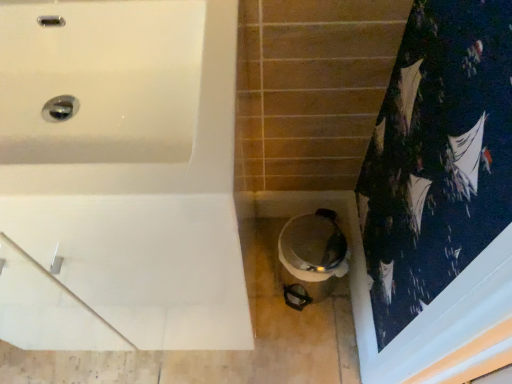
Question: Is white glossy bathtub at upper left to the right of white glossy toilet at lower center from the viewer's perspective?

Choices:
 (A) yes
 (B) no

Answer: (B)

Question: From the image's perspective, is white glossy bathtub at upper left below white glossy toilet at lower center?

Choices:
 (A) no
 (B) yes

Answer: (A)

Question: From the image's perspective, would you say white glossy bathtub at upper left is positioned over white glossy toilet at lower center?

Choices:
 (A) yes
 (B) no

Answer: (A)

Question: Is white glossy bathtub at upper left not near white glossy toilet at lower center?

Choices:
 (A) yes
 (B) no

Answer: (B)

Question: Does white glossy bathtub at upper left have a smaller size compared to white glossy toilet at lower center?

Choices:
 (A) no
 (B) yes

Answer: (A)

Question: From a real-world perspective, is white glossy bathtub at upper left physically above white glossy toilet at lower center?

Choices:
 (A) yes
 (B) no

Answer: (A)

Question: From the image's perspective, would you say white glossy toilet at lower center is positioned over white glossy bathtub at upper left?

Choices:
 (A) no
 (B) yes

Answer: (A)

Question: Does white glossy toilet at lower center come in front of white glossy bathtub at upper left?

Choices:
 (A) no
 (B) yes

Answer: (A)

Question: Can you confirm if white glossy toilet at lower center is smaller than white glossy bathtub at upper left?

Choices:
 (A) yes
 (B) no

Answer: (A)

Question: Is white glossy toilet at lower center bigger than white glossy bathtub at upper left?

Choices:
 (A) no
 (B) yes

Answer: (A)

Question: Is white glossy toilet at lower center shorter than white glossy bathtub at upper left?

Choices:
 (A) no
 (B) yes

Answer: (B)

Question: Would you consider white glossy toilet at lower center to be distant from white glossy bathtub at upper left?

Choices:
 (A) no
 (B) yes

Answer: (A)

Question: Do you think white glossy toilet at lower center is within white glossy bathtub at upper left, or outside of it?

Choices:
 (A) inside
 (B) outside

Answer: (B)